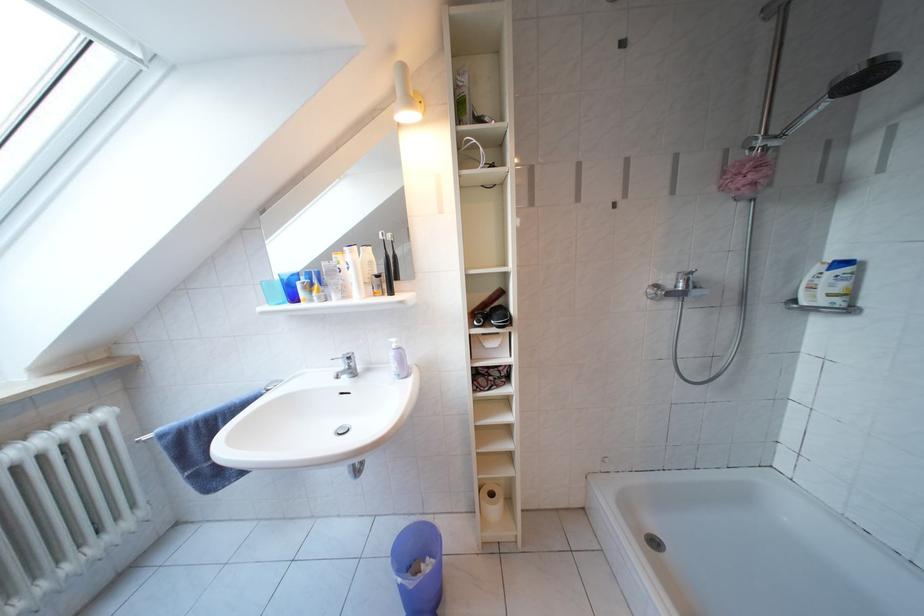
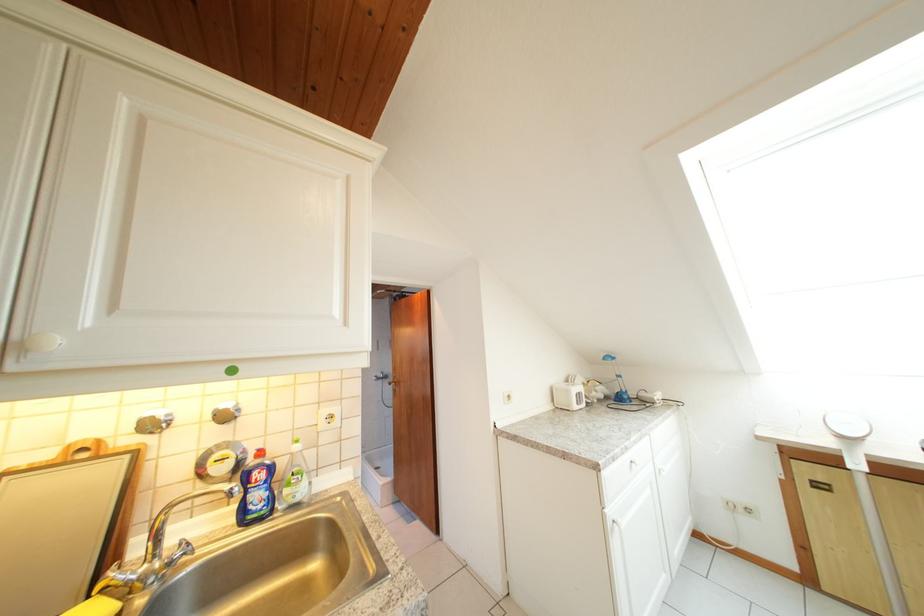
Question: I am providing you with two images of the same scene from different viewpoints. After the viewpoint changes to image2, which objects are now occluded?

Choices:
 (A) black toothbrush
 (B) brown door handle
 (C) shower faucet handle
 (D) metal dog bowl

Answer: (A)